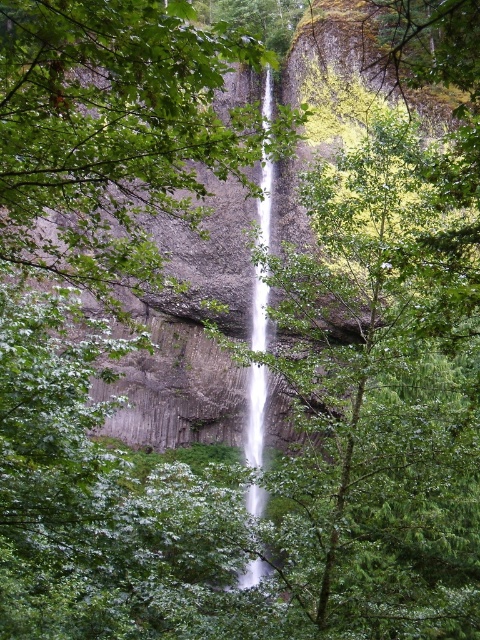
You are a hiker standing at the base of the cliff. You see the green leafy tree at center and the white smooth waterfall at center. Which object is higher up the cliff?

The green leafy tree at center is located above the white smooth waterfall at center, so the green leafy tree at center is higher up the cliff.

You are a hiker standing at the base of the cliff. You see the green leafy tree at center and the white smooth waterfall at center. Which object is closer to you?

The green leafy tree at center is closer to you because it is positioned in front of the white smooth waterfall at center.